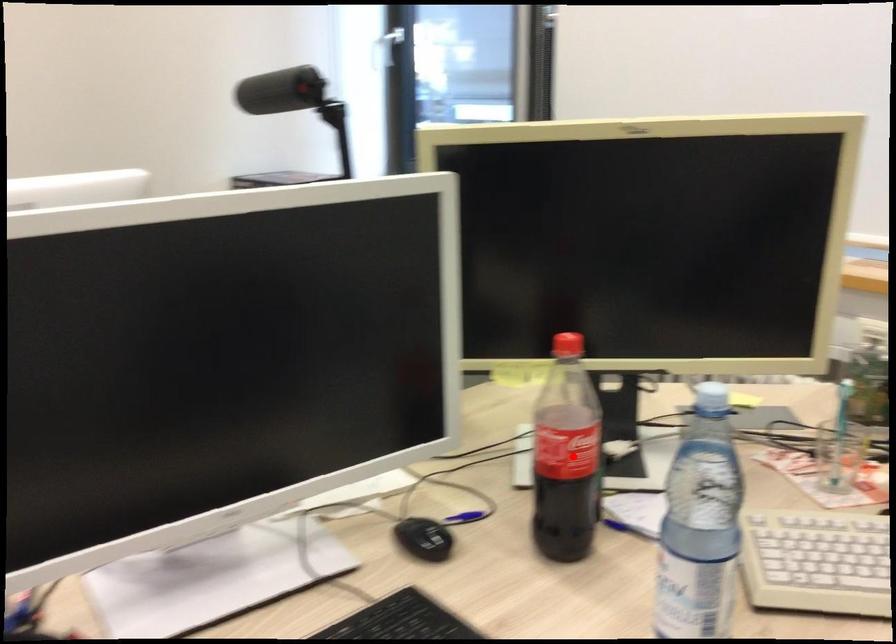
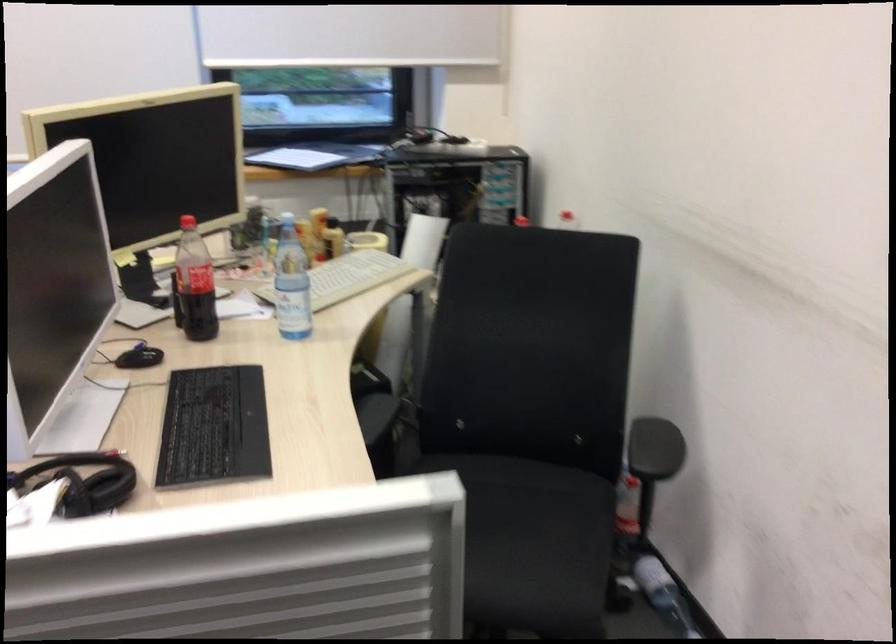
Question: I am providing you with two images of the same scene from different viewpoints. A red point is shown in image1. For the corresponding object point in image2, is it positioned nearer or farther from the camera?

Choices:
 (A) Nearer
 (B) Farther

Answer: (B)